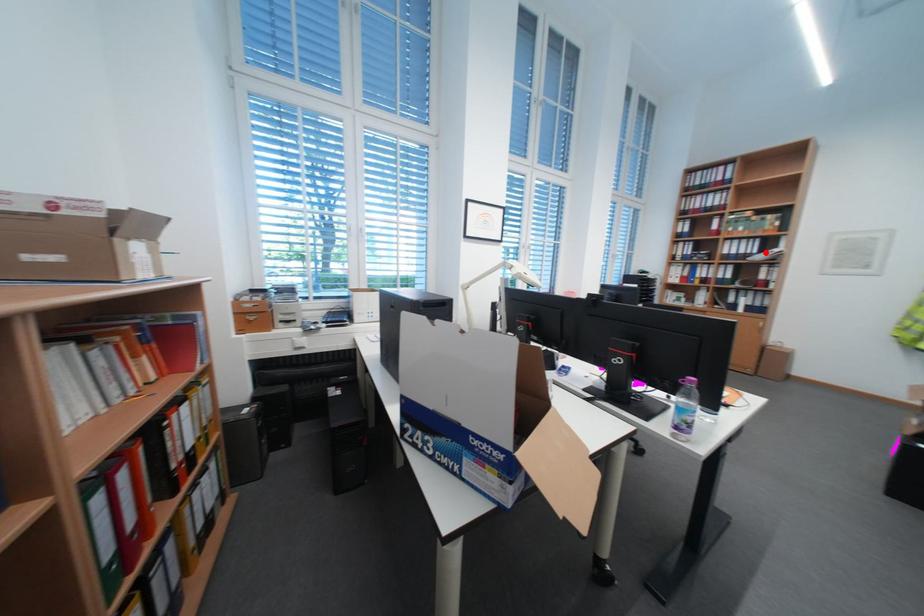
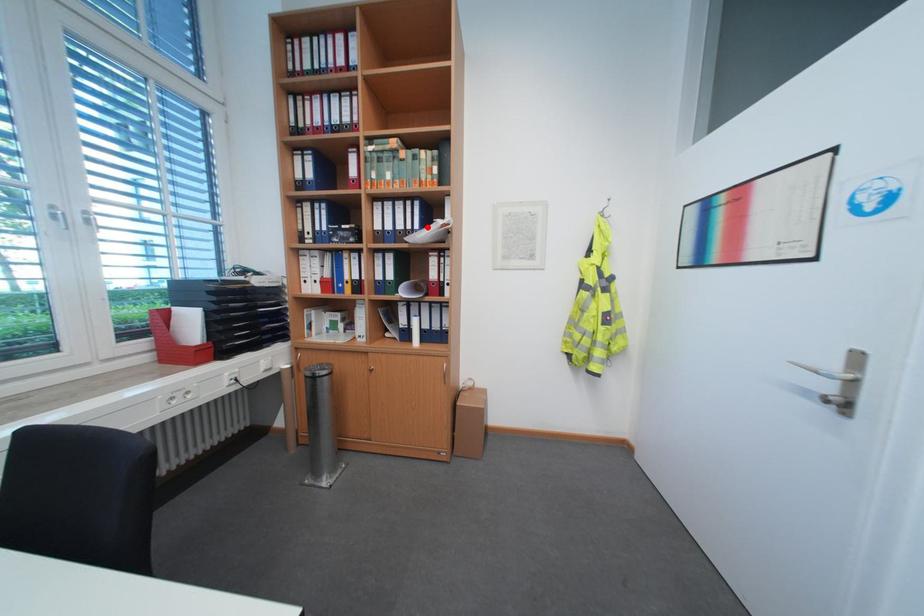
I am providing you with two images of the same scene from different viewpoints. A red point is marked on the first image and another point is marked on the second image. Is the marked point in image1 the same physical position as the marked point in image2?

Yes